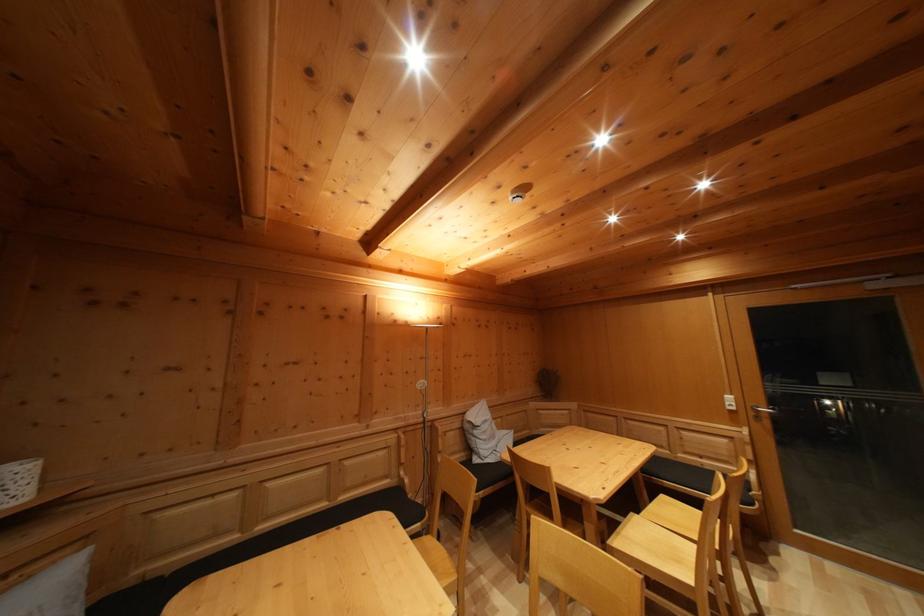
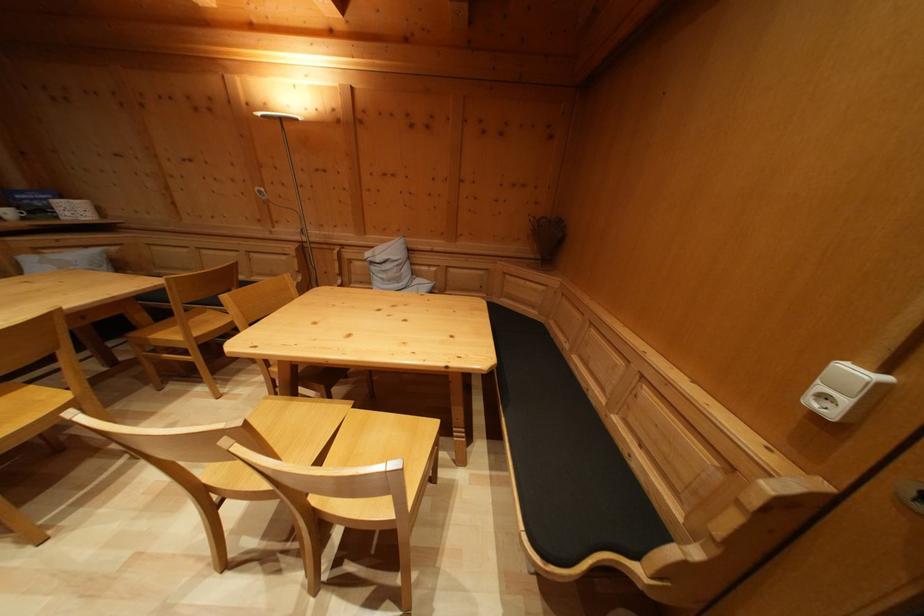
In the second image, find the point that corresponds to point 736,405 in the first image.

(859, 379)